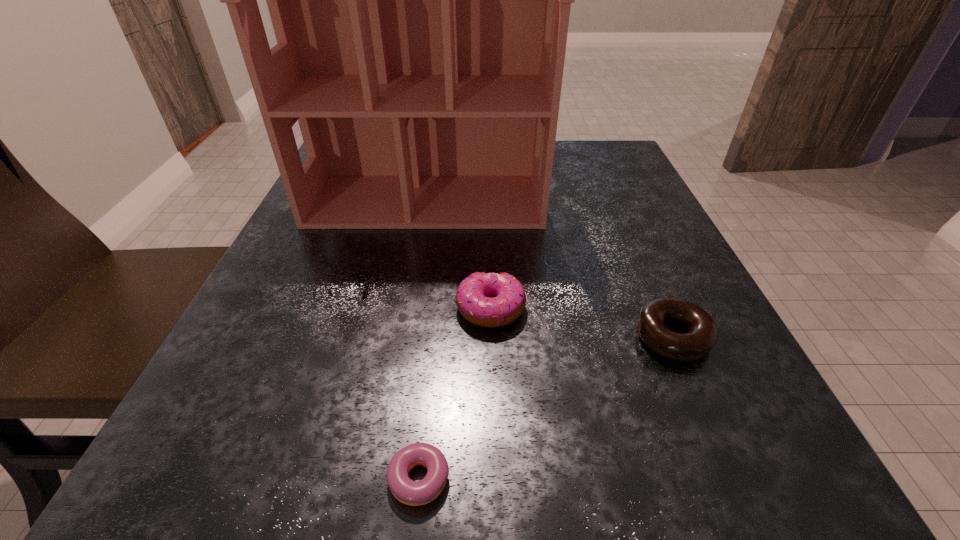
In the image, there is a desktop. At what (x,y) coordinates should I click in order to perform the action: click on vacant space at the far right corner. Please return your answer as a coordinate pair (x, y). This screenshot has width=960, height=540. Looking at the image, I should click on click(x=588, y=181).

Identify the location of vacant space in between the second shortest object and the dollhouse. (549, 269).

Where is `vacant area that lies between the rightmost doughnut and the tallest doughnut`? The width and height of the screenshot is (960, 540). vacant area that lies between the rightmost doughnut and the tallest doughnut is located at coordinates (582, 323).

The width and height of the screenshot is (960, 540). I want to click on free spot between the nearest object and the tallest doughnut, so click(x=451, y=394).

I want to click on empty space that is in between the shortest doughnut and the rightmost object, so click(542, 408).

Identify the location of free point between the rightmost doughnut and the tallest doughnut. The image size is (960, 540). (582, 323).

I want to click on empty space between the second shortest object and the farthest object, so click(x=549, y=269).

The image size is (960, 540). Identify the location of vacant region between the third shortest object and the nearest object. (451, 394).

Where is `vacant space in between the dollhouse and the shortest object`? vacant space in between the dollhouse and the shortest object is located at coordinates (420, 340).

Image resolution: width=960 pixels, height=540 pixels. I want to click on vacant space that's between the rightmost object and the nearest object, so click(x=542, y=408).